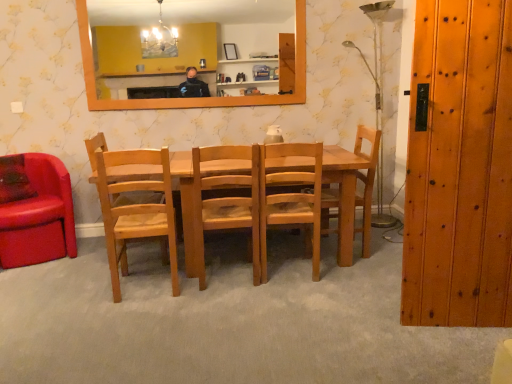
The height and width of the screenshot is (384, 512). I want to click on vacant area that is in front of leather couch at left, which ranks as the 5th chair in right-to-left order, so click(36, 278).